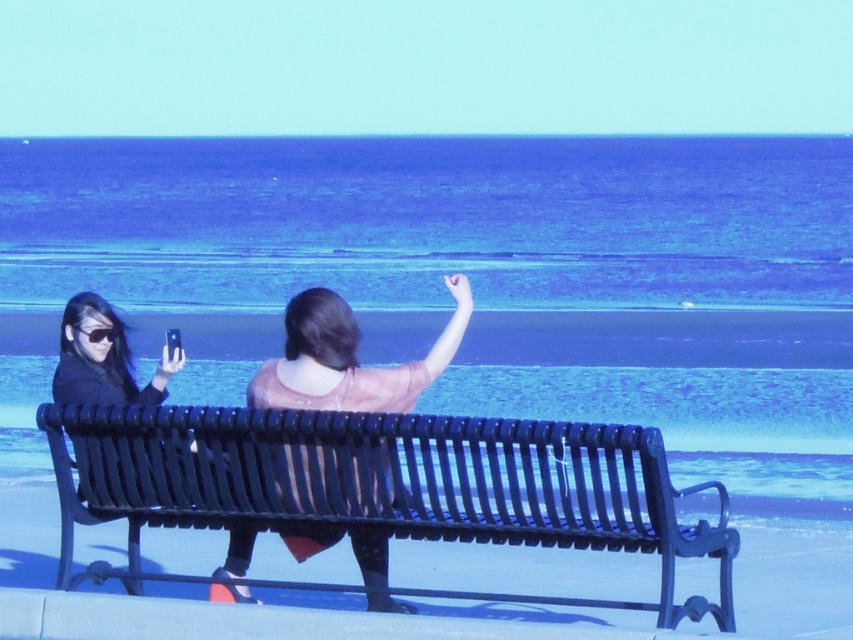
Who is higher up, black metal bench at lower center or pink sheer blouse at center?

Positioned higher is pink sheer blouse at center.

Which is below, black metal bench at lower center or pink sheer blouse at center?

black metal bench at lower center

Identify the location of black metal bench at lower center. This screenshot has height=640, width=853. (383, 486).

What are the coordinates of `black metal bench at lower center` in the screenshot? It's located at (383, 486).

Between black metal bench at lower center and matte black hair at left, which one appears on the left side from the viewer's perspective?

A: matte black hair at left is more to the left.

Can you confirm if black metal bench at lower center is taller than matte black hair at left?

Correct, black metal bench at lower center is much taller as matte black hair at left.

Between point (297, 451) and point (109, 397), which one is positioned behind?

The point (109, 397) is behind.

The height and width of the screenshot is (640, 853). Find the location of `black metal bench at lower center`. black metal bench at lower center is located at coordinates (383, 486).

Is point (318, 378) positioned after point (84, 317)?

No, it is in front of (84, 317).

Which is behind, point (374, 369) or point (80, 400)?

Positioned behind is point (80, 400).

This screenshot has width=853, height=640. Identify the location of pink sheer blouse at center. (347, 358).